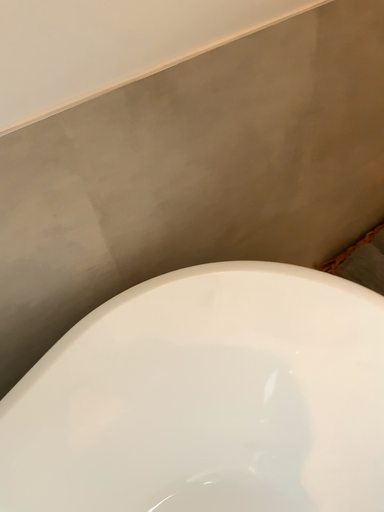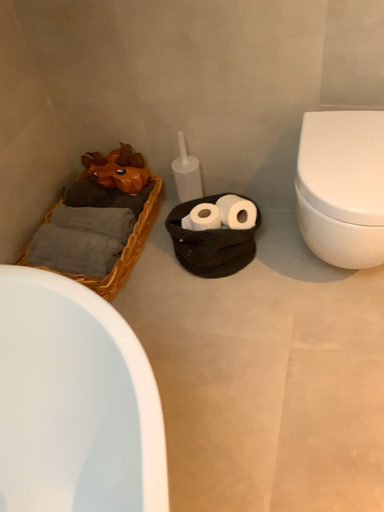
Question: Which way did the camera rotate in the video?

Choices:
 (A) rotated upward
 (B) rotated downward

Answer: (A)